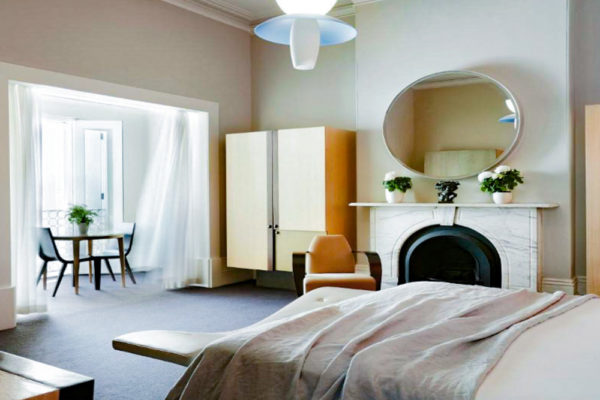
Locate an element on the screen. table is located at coordinates (79, 238).